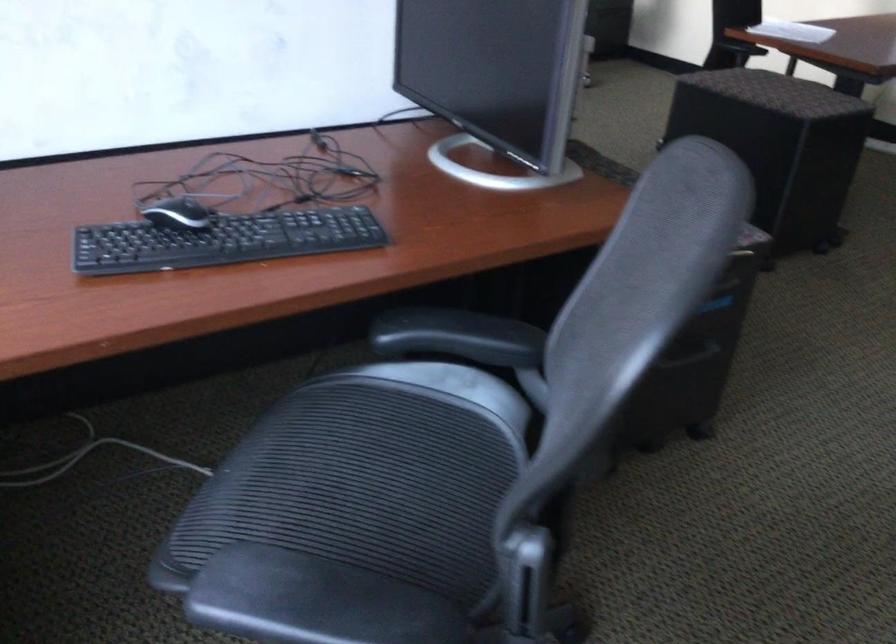
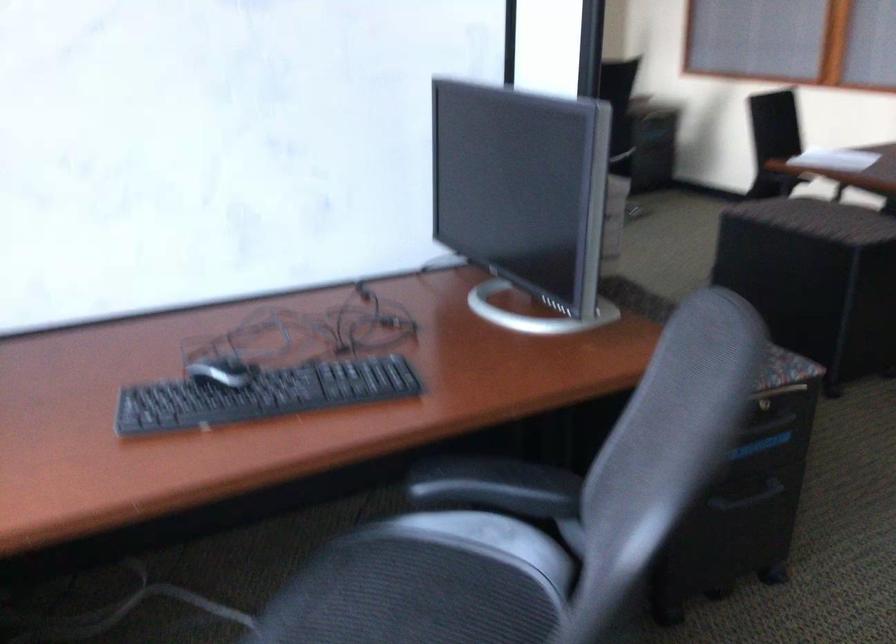
Find the pixel in the second image that matches the point at 375,436 in the first image.

(410, 596)